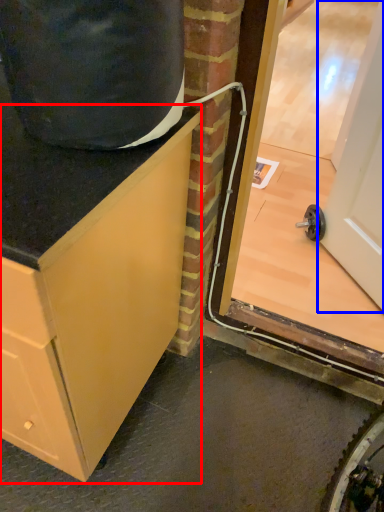
Question: Which point is closer to the camera, cabinetry (highlighted by a red box) or door (highlighted by a blue box)?

Choices:
 (A) cabinetry
 (B) door

Answer: (A)